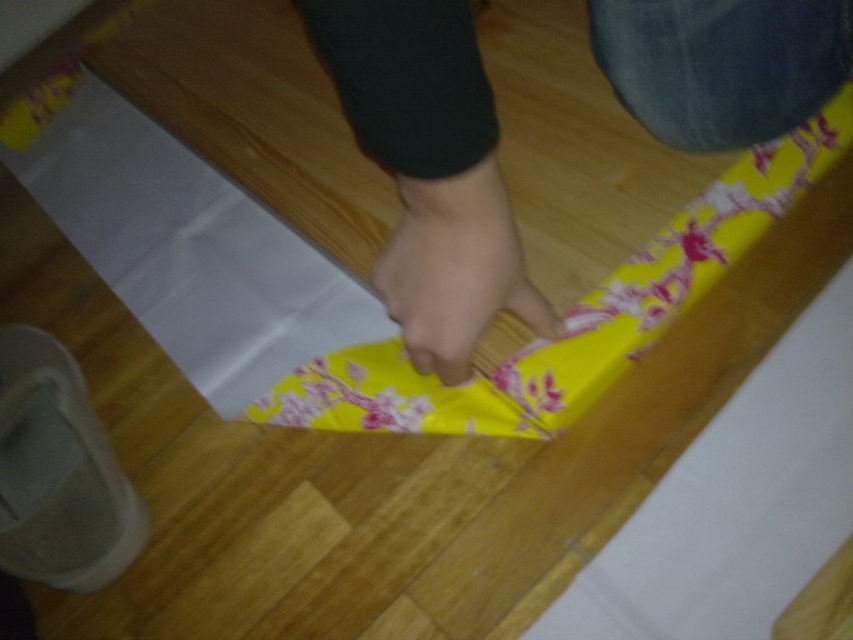
Question: Can you confirm if yellow floral fabric at center is thinner than smooth skin hand at center?

Choices:
 (A) yes
 (B) no

Answer: (B)

Question: Estimate the real-world distances between objects in this image. Which object is farther from the yellow floral fabric at center?

Choices:
 (A) smooth skin hand at center
 (B) white paper at center

Answer: (B)

Question: Which point appears farthest from the camera in this image?

Choices:
 (A) (431, 284)
 (B) (457, 326)
 (C) (181, 228)

Answer: (C)

Question: Does white paper at center have a larger size compared to smooth skin hand at center?

Choices:
 (A) yes
 (B) no

Answer: (A)

Question: Which object is positioned farthest from the yellow floral fabric at center?

Choices:
 (A) white paper at center
 (B) smooth skin hand at center

Answer: (A)

Question: Is yellow floral fabric at center positioned behind white paper at center?

Choices:
 (A) no
 (B) yes

Answer: (A)